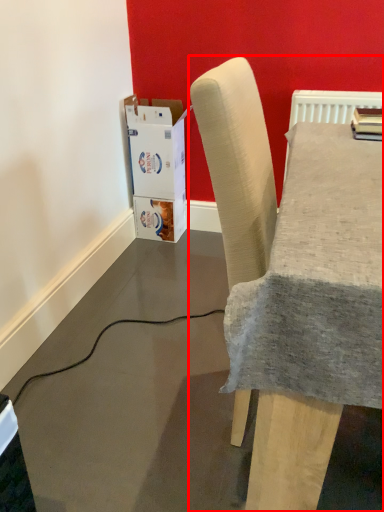
Question: Observing the image, what is the correct spatial positioning of chair (annotated by the red box) in reference to cardboard box?

Choices:
 (A) left
 (B) right

Answer: (B)